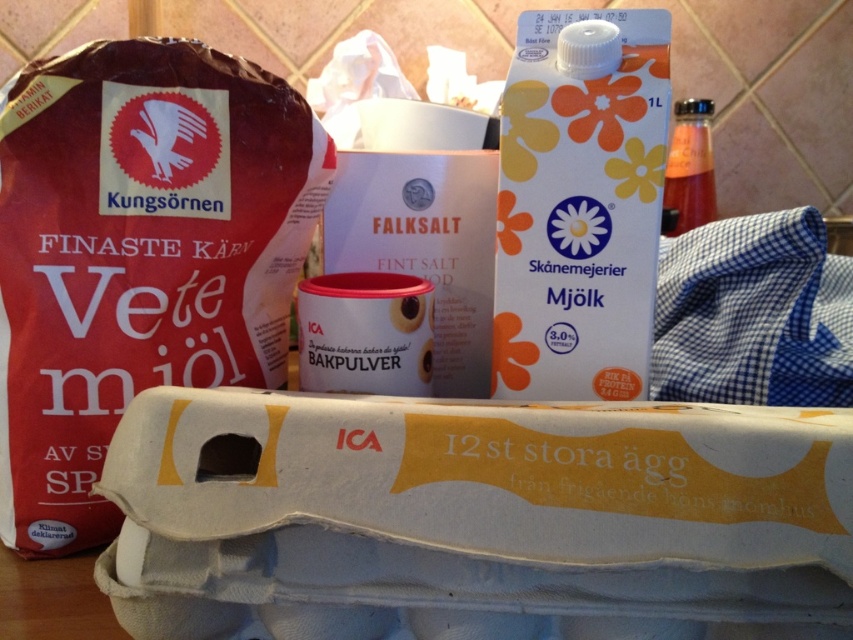
Does white paper milk carton at center have a smaller size compared to translucent glass bottle at upper right?

Yes.

Measure the distance between point (538, 250) and camera.

44.12 centimeters

Is point (589, 212) positioned behind point (662, 214)?

Yes, point (589, 212) is farther from viewer.

Locate an element on the screen. white paper milk carton at center is located at coordinates (579, 204).

Who is taller, brown paper bag at left or white paper milk carton at center?

With more height is brown paper bag at left.

Is the position of brown paper bag at left less distant than that of white paper milk carton at center?

Yes, it is.

At what (x,y) coordinates should I click in order to perform the action: click on brown paper bag at left. Please return your answer as a coordinate pair (x, y). The height and width of the screenshot is (640, 853). Looking at the image, I should click on (137, 256).

Does point (19, 157) come in front of point (712, 179)?

Yes, it is in front of point (712, 179).

How distant is brown paper bag at left from translucent glass bottle at upper right?

A distance of 23.66 inches exists between brown paper bag at left and translucent glass bottle at upper right.

Identify the location of brown paper bag at left. (137, 256).